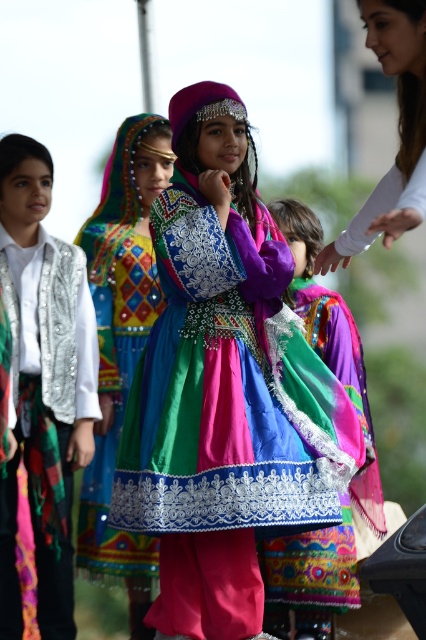
Is silky satin dress at center taller than white matte sleeve at upper right?

Yes, silky satin dress at center is taller than white matte sleeve at upper right.

Does silky satin dress at center have a lesser width compared to white matte sleeve at upper right?

No.

The image size is (426, 640). What do you see at coordinates (224, 388) in the screenshot?
I see `silky satin dress at center` at bounding box center [224, 388].

Where is `silky satin dress at center`? This screenshot has height=640, width=426. silky satin dress at center is located at coordinates (224, 388).

Is silky satin dress at center in front of multicolored embroidered dress at center?

Yes, silky satin dress at center is in front of multicolored embroidered dress at center.

Is point (203, 184) more distant than point (134, 196)?

No, (203, 184) is closer to viewer.

Between point (333, 388) and point (120, 236), which one is positioned behind?

Point (120, 236)

Locate an element on the screen. silky satin dress at center is located at coordinates (224, 388).

Can you confirm if silver sequined vest at left is positioned to the right of white matte sleeve at upper right?

No, silver sequined vest at left is not to the right of white matte sleeve at upper right.

Which is more to the left, silver sequined vest at left or white matte sleeve at upper right?

From the viewer's perspective, silver sequined vest at left appears more on the left side.

At what (x,y) coordinates should I click in order to perform the action: click on silver sequined vest at left. Please return your answer as a coordinate pair (x, y). Looking at the image, I should click on (49, 394).